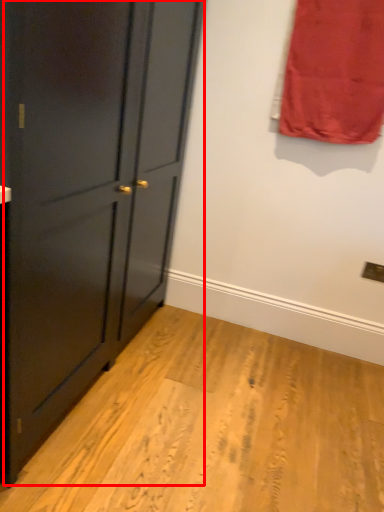
Question: From the image's perspective, what is the correct spatial relationship of door (annotated by the red box) in relation to curtain?

Choices:
 (A) below
 (B) above

Answer: (A)